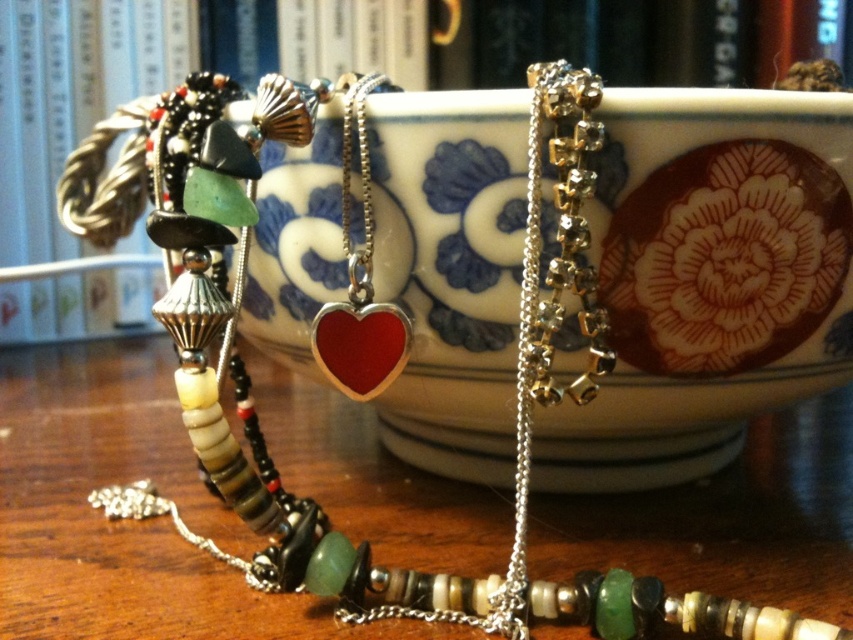
You are standing in a room with a matte white bookshelf at upper center and another object. The distance between them is 1.59 meters. If you want to place a 1.5 meter long ladder between them, will it fit without overlapping either?

The distance between the matte white bookshelf at upper center and the other object is 1.59 meters. Since the ladder is 1.5 meters long, which is shorter than the distance, it will fit without overlapping either.

Looking at this image, you are standing in a room and want to place a new book on the shelf at point [99,88]. Can you tell me where exactly the matte white bookshelf at upper center is located?

The matte white bookshelf at upper center is located at point [99,88].

Looking at this image, you are organizing a display and need to place a new item between the matte white bookshelf at upper center and the shiny red heart at center. Which object should you place the new item closer to in order to maintain the existing spatial relationship?

You should place the new item closer to the shiny red heart at center because the matte white bookshelf at upper center is further away from the viewer, so maintaining the spatial relationship requires the new item to be nearer to the closer object.